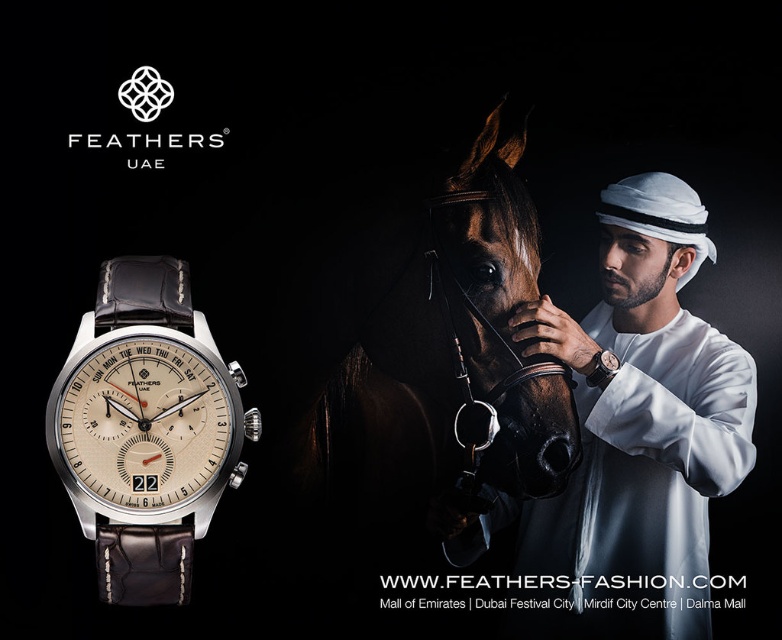
Question: Which point is closer to the camera taking this photo?

Choices:
 (A) (151, 560)
 (B) (673, 280)
 (C) (603, 369)
 (D) (479, 196)

Answer: (D)

Question: Which point is closer to the camera?

Choices:
 (A) satin silver watch at center
 (B) satin brown leather watch at center
 (C) white leather watch at center
 (D) brown leather horse at center

Answer: (D)

Question: Is white leather watch at center wider than satin silver watch at center?

Choices:
 (A) no
 (B) yes

Answer: (B)

Question: Which of the following is the closest to the observer?

Choices:
 (A) satin silver watch at center
 (B) satin brown leather watch at center
 (C) brown leather horse at center

Answer: (C)

Question: Does white leather watch at center have a smaller size compared to brown leather horse at center?

Choices:
 (A) no
 (B) yes

Answer: (B)

Question: Is satin brown leather watch at center below satin silver watch at center?

Choices:
 (A) yes
 (B) no

Answer: (A)